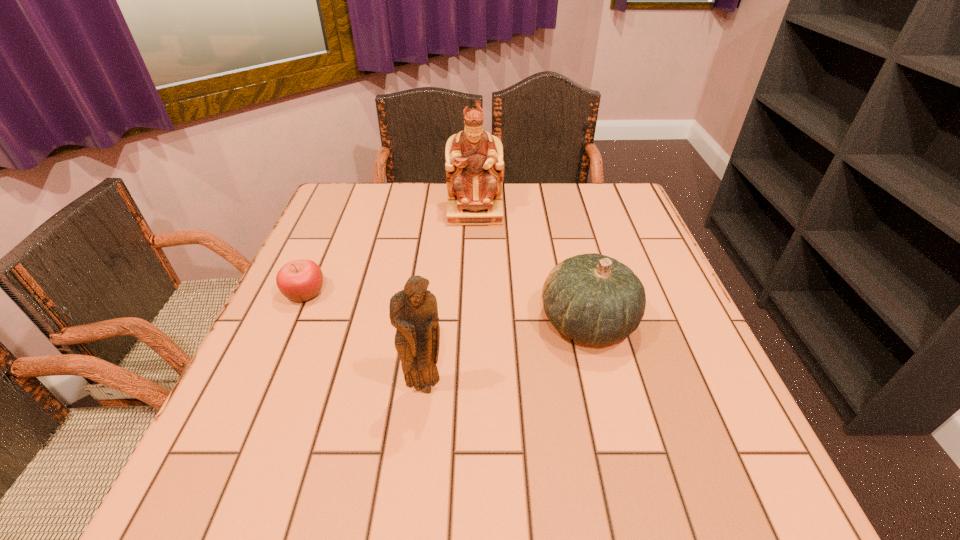
You are a GUI agent. You are given a task and a screenshot of the screen. Output one action in this format:
    pyautogui.click(x=<x>, y=<y>)
    Task: Click on the vacant point that satisfies the following two spatial constraints: 1. on the front-facing side of the farthest object; 2. on the left side of the gourd
    Image resolution: width=960 pixels, height=540 pixels.
    Given the screenshot: What is the action you would take?
    pyautogui.click(x=473, y=322)

Locate an element on the screen. Image resolution: width=960 pixels, height=540 pixels. vacant space that satisfies the following two spatial constraints: 1. on the front side of the leftmost object; 2. on the left side of the gourd is located at coordinates (293, 322).

Where is `vacant area that satisfies the following two spatial constraints: 1. on the front side of the shortest object; 2. on the left side of the gourd`? The image size is (960, 540). vacant area that satisfies the following two spatial constraints: 1. on the front side of the shortest object; 2. on the left side of the gourd is located at coordinates (293, 322).